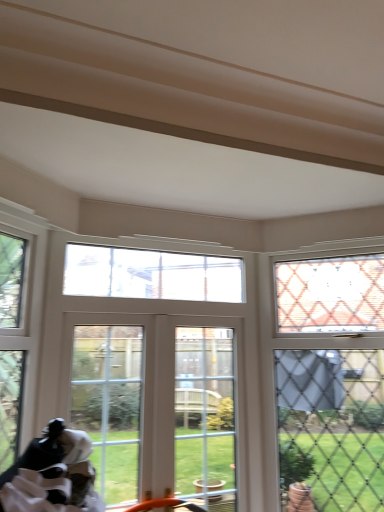
Locate an element on the screen. The image size is (384, 512). vacant area on top of clear glass door at center (from a real-world perspective) is located at coordinates (118, 312).